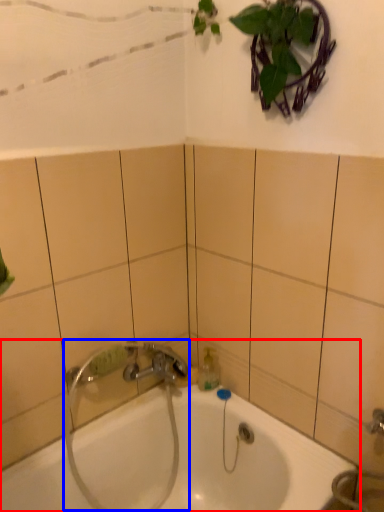
Question: Which of the following is the farthest to the observer, bathtub (highlighted by a red box) or plumbing fixture (highlighted by a blue box)?

Choices:
 (A) bathtub
 (B) plumbing fixture

Answer: (B)